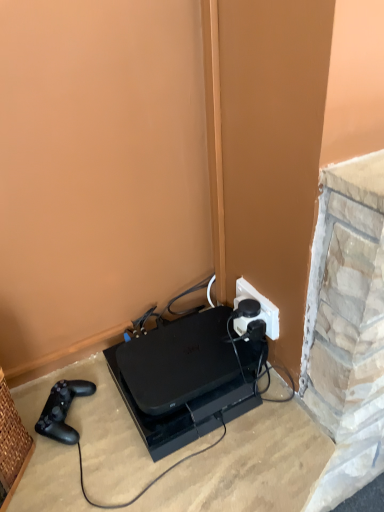
Question: Is black plastic gaming console at lower center looking in the opposite direction of white plastic power plugs and sockets at center-right?

Choices:
 (A) no
 (B) yes

Answer: (A)

Question: Does black plastic gaming console at lower center have a greater height compared to white plastic power plugs and sockets at center-right?

Choices:
 (A) no
 (B) yes

Answer: (A)

Question: Is black plastic gaming console at lower center not near white plastic power plugs and sockets at center-right?

Choices:
 (A) yes
 (B) no

Answer: (B)

Question: From a real-world perspective, is black plastic gaming console at lower center positioned under white plastic power plugs and sockets at center-right based on gravity?

Choices:
 (A) no
 (B) yes

Answer: (B)

Question: Does black plastic gaming console at lower center appear on the left side of white plastic power plugs and sockets at center-right?

Choices:
 (A) yes
 (B) no

Answer: (A)

Question: Visually, is black matte game controller at lower left positioned to the left or to the right of white plastic power plugs and sockets at center-right?

Choices:
 (A) right
 (B) left

Answer: (B)

Question: Is black matte game controller at lower left spatially inside white plastic power plugs and sockets at center-right, or outside of it?

Choices:
 (A) inside
 (B) outside

Answer: (B)

Question: Relative to white plastic power plugs and sockets at center-right, is black matte game controller at lower left in front or behind?

Choices:
 (A) behind
 (B) front

Answer: (B)

Question: From a real-world perspective, is black matte game controller at lower left above or below white plastic power plugs and sockets at center-right?

Choices:
 (A) above
 (B) below

Answer: (B)

Question: From a real-world perspective, is black plastic gaming console at lower center above or below white plastic power plugs and sockets at center-right?

Choices:
 (A) below
 (B) above

Answer: (A)

Question: Visually, is black plastic gaming console at lower center positioned to the left or to the right of white plastic power plugs and sockets at center-right?

Choices:
 (A) left
 (B) right

Answer: (A)

Question: Considering the positions of black plastic gaming console at lower center and white plastic power plugs and sockets at center-right in the image, is black plastic gaming console at lower center wider or thinner than white plastic power plugs and sockets at center-right?

Choices:
 (A) wide
 (B) thin

Answer: (A)

Question: Is point (134, 343) closer or farther from the camera than point (249, 284)?

Choices:
 (A) farther
 (B) closer

Answer: (A)

Question: Considering the positions of white plastic power plugs and sockets at center-right and black plastic gaming console at lower center in the image, is white plastic power plugs and sockets at center-right taller or shorter than black plastic gaming console at lower center?

Choices:
 (A) short
 (B) tall

Answer: (B)

Question: Is point (236, 287) closer or farther from the camera than point (139, 362)?

Choices:
 (A) farther
 (B) closer

Answer: (A)